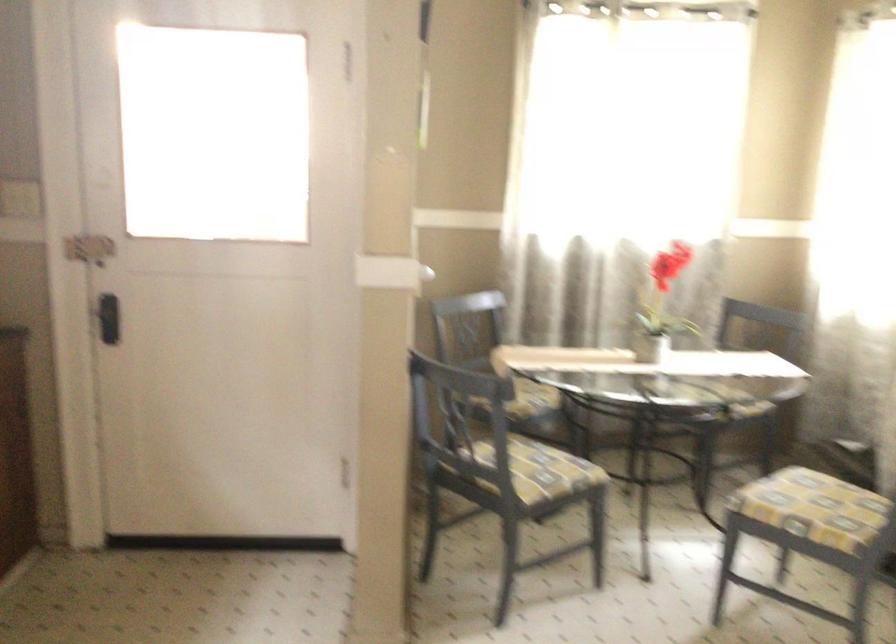
What do you see at coordinates (108, 317) in the screenshot? I see `a black door handle` at bounding box center [108, 317].